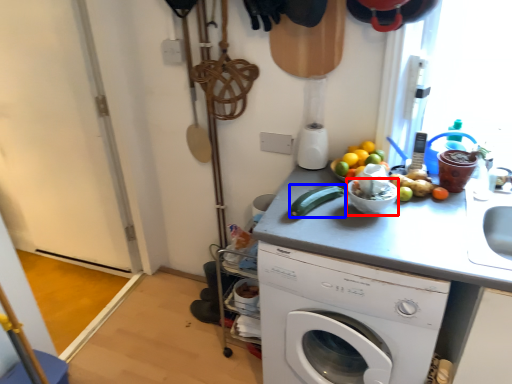
Question: Which of the following is the farthest to the observer, basin (highlighted by a red box) or cucumber (highlighted by a blue box)?

Choices:
 (A) basin
 (B) cucumber

Answer: (B)